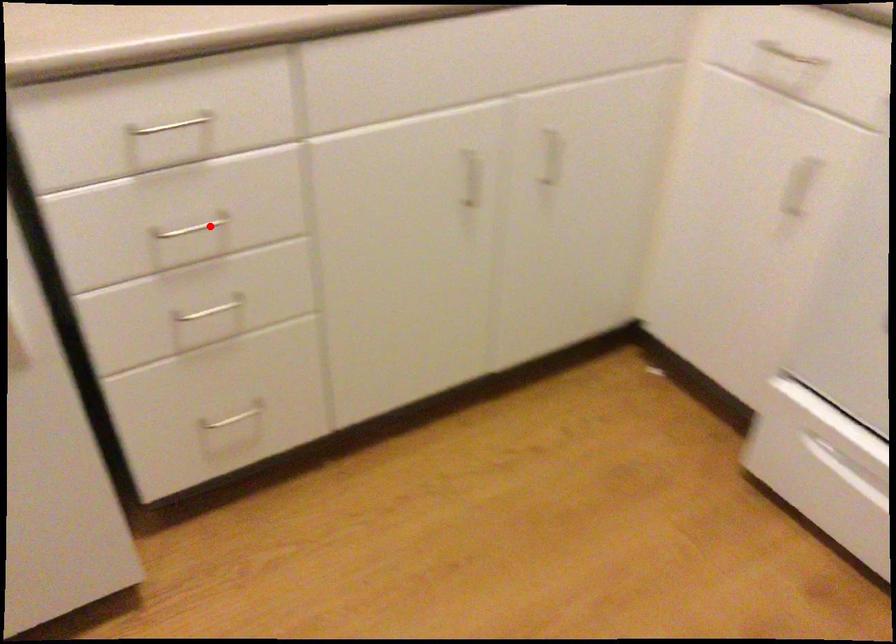
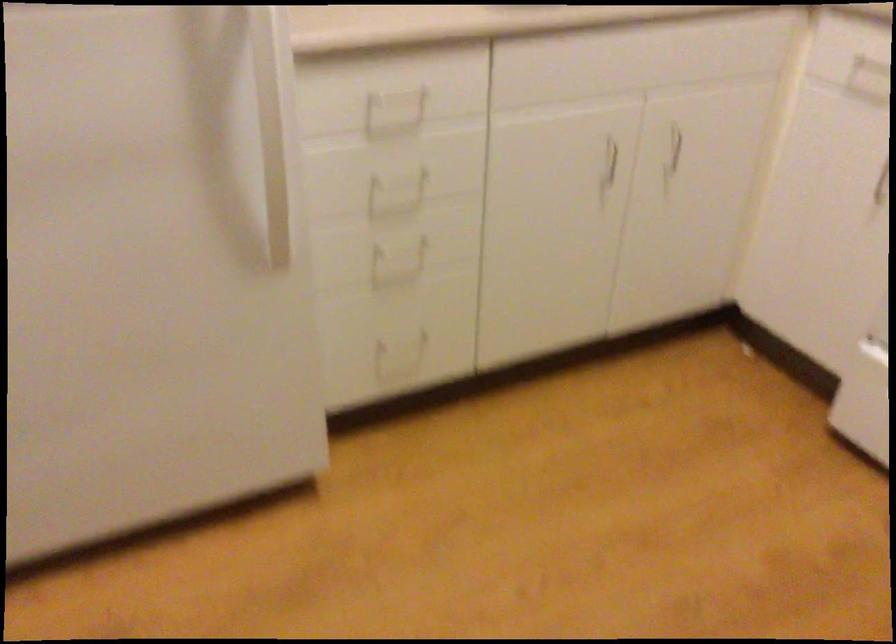
Locate, in the second image, the point that corresponds to the highlighted location in the first image.

(405, 178)